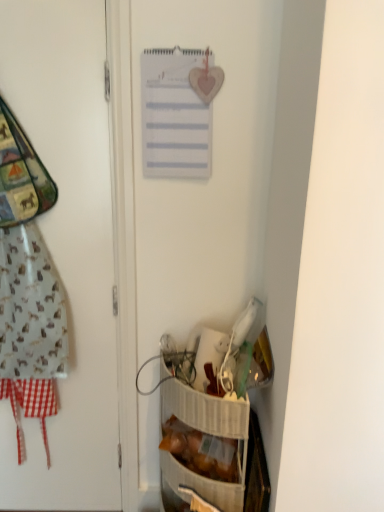
Question: From a real-world perspective, is translucent plastic bag of bread at lower right located higher than white paper calendar at upper center?

Choices:
 (A) no
 (B) yes

Answer: (A)

Question: Is translucent plastic bag of bread at lower right shorter than white paper calendar at upper center?

Choices:
 (A) no
 (B) yes

Answer: (B)

Question: Considering the relative sizes of translucent plastic bag of bread at lower right and white paper calendar at upper center in the image provided, is translucent plastic bag of bread at lower right taller than white paper calendar at upper center?

Choices:
 (A) yes
 (B) no

Answer: (B)

Question: Is translucent plastic bag of bread at lower right at the right side of white paper calendar at upper center?

Choices:
 (A) no
 (B) yes

Answer: (B)

Question: Are translucent plastic bag of bread at lower right and white paper calendar at upper center making contact?

Choices:
 (A) no
 (B) yes

Answer: (A)

Question: From a real-world perspective, is translucent plastic bag of bread at lower right located beneath white paper calendar at upper center?

Choices:
 (A) yes
 (B) no

Answer: (A)

Question: Is translucent plastic bag of bread at lower right surrounded by white matte door at left?

Choices:
 (A) no
 (B) yes

Answer: (A)

Question: Considering the relative sizes of white matte door at left and translucent plastic bag of bread at lower right in the image provided, is white matte door at left shorter than translucent plastic bag of bread at lower right?

Choices:
 (A) yes
 (B) no

Answer: (B)

Question: Is white matte door at left thinner than translucent plastic bag of bread at lower right?

Choices:
 (A) yes
 (B) no

Answer: (A)

Question: Is the depth of white matte door at left greater than that of translucent plastic bag of bread at lower right?

Choices:
 (A) no
 (B) yes

Answer: (A)

Question: From the image's perspective, does white matte door at left appear higher than translucent plastic bag of bread at lower right?

Choices:
 (A) no
 (B) yes

Answer: (B)

Question: Does white matte door at left have a greater width compared to translucent plastic bag of bread at lower right?

Choices:
 (A) yes
 (B) no

Answer: (B)

Question: Considering the relative sizes of translucent plastic bag of bread at lower right and white matte door at left in the image provided, is translucent plastic bag of bread at lower right taller than white matte door at left?

Choices:
 (A) yes
 (B) no

Answer: (B)